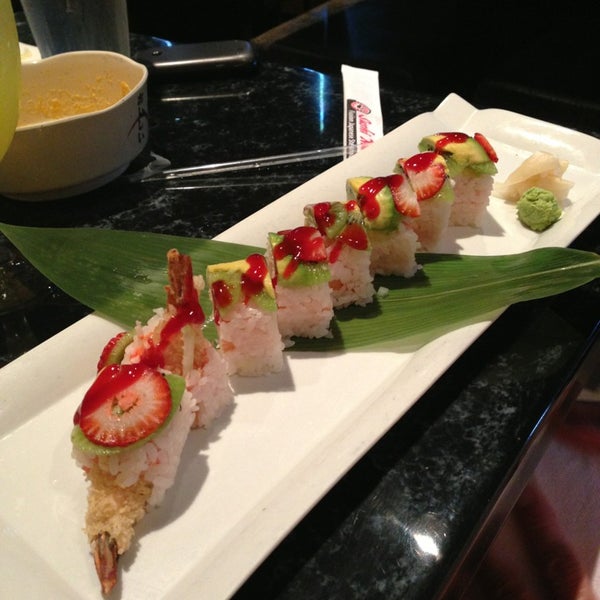
Identify the location of bowl. The image size is (600, 600). coord(80,153).